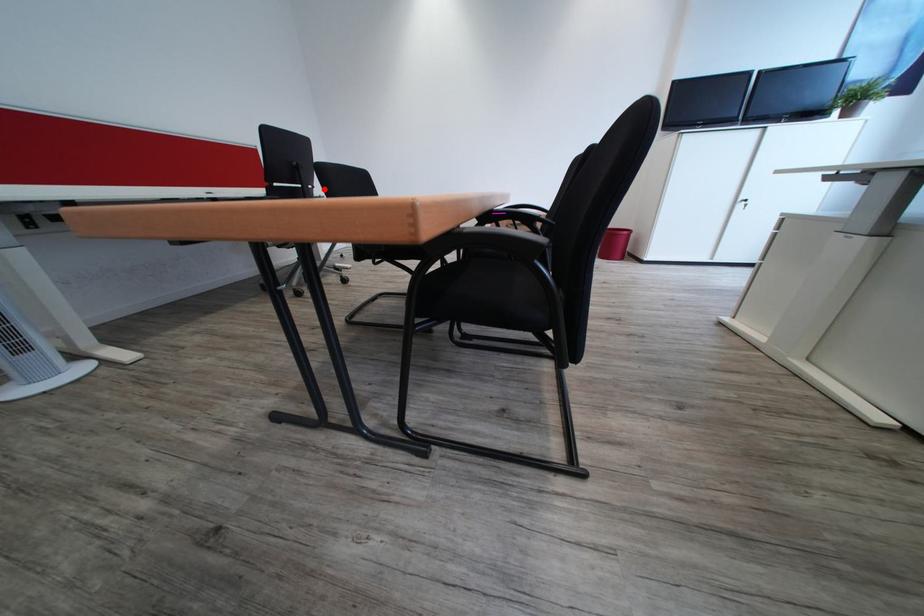
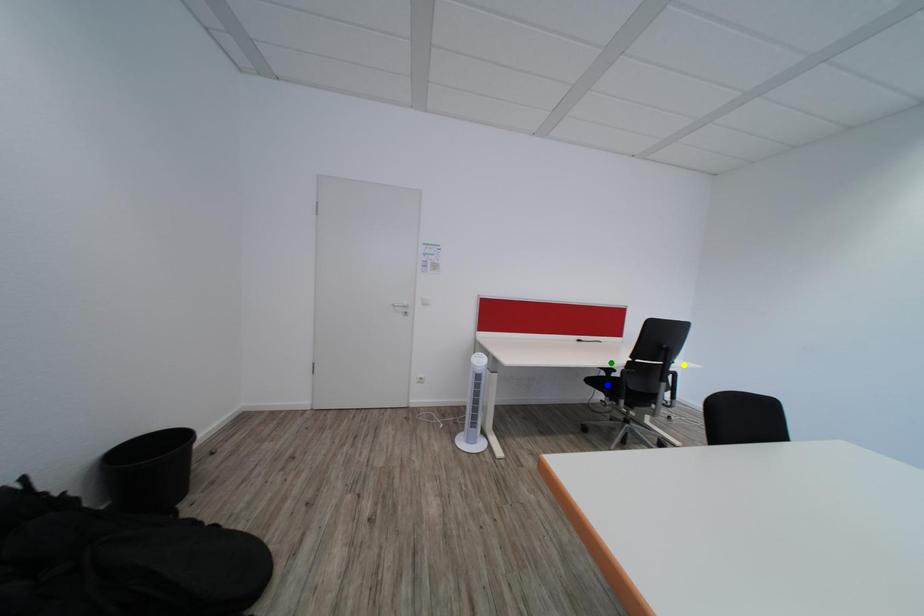
Question: I am providing you with two images of the same scene from different viewpoints. A red point is marked on the first image. You are given multiple points on the second image. Which point in image 2 is actually the same real-world point as the red point in image 1?

Choices:
 (A) green point
 (B) blue point
 (C) yellow point

Answer: (C)